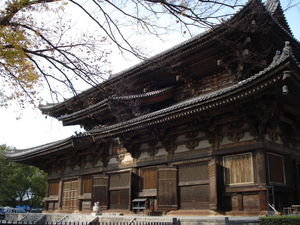
What are the coordinates of `doorway` in the screenshot? It's located at (192, 197).